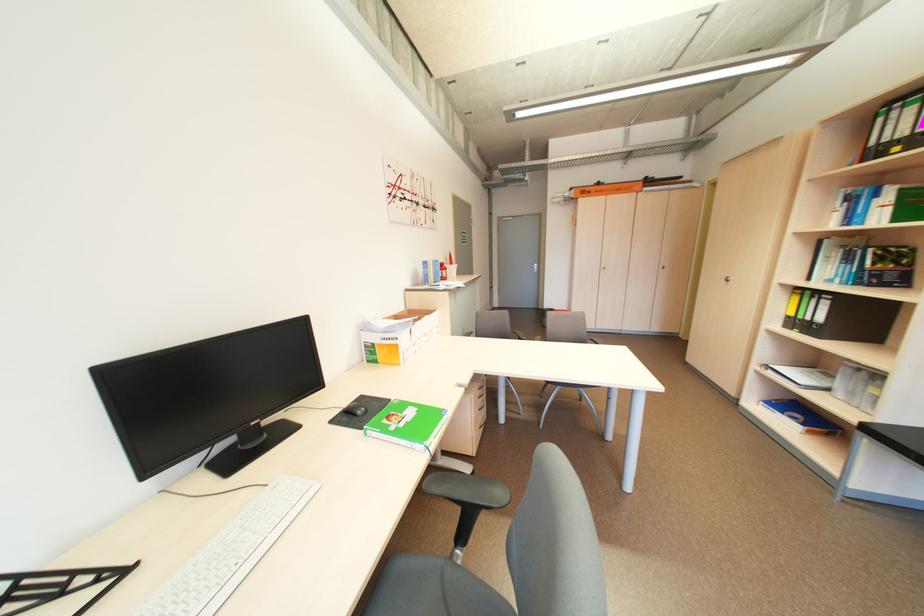
Where would you lift the cardboard box? Please return your answer as a coordinate pair (x, y).

(397, 334)